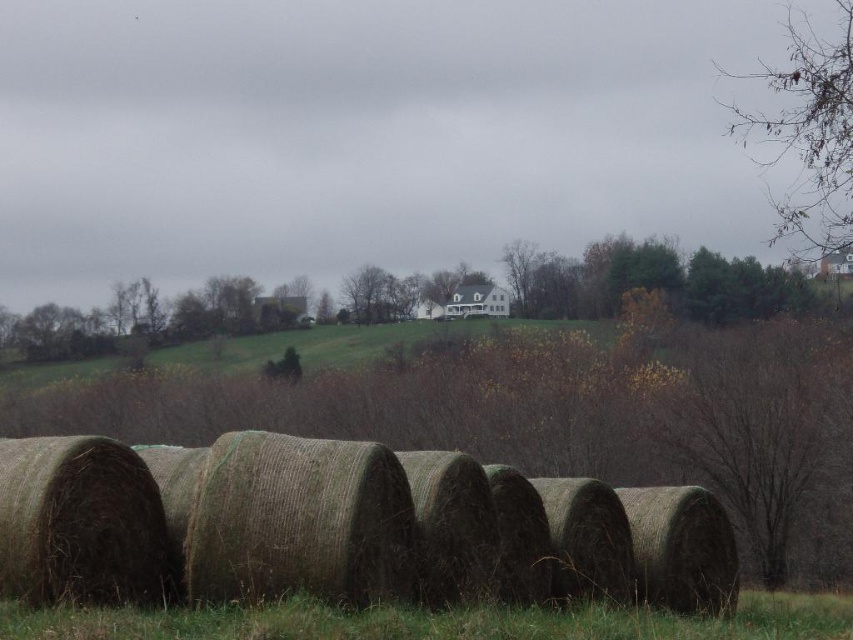
Question: Which of the following is the farthest from the observer?

Choices:
 (A) (32, 611)
 (B) (370, 451)

Answer: (B)

Question: Does green straw bales at center have a larger size compared to green grass at lower center?

Choices:
 (A) no
 (B) yes

Answer: (A)

Question: Which object is closer to the camera taking this photo?

Choices:
 (A) green grass at lower center
 (B) green straw bales at center

Answer: (A)

Question: Does green straw bales at center appear on the right side of green grass at lower center?

Choices:
 (A) yes
 (B) no

Answer: (B)

Question: Does green straw bales at center appear on the left side of green grass at lower center?

Choices:
 (A) yes
 (B) no

Answer: (A)